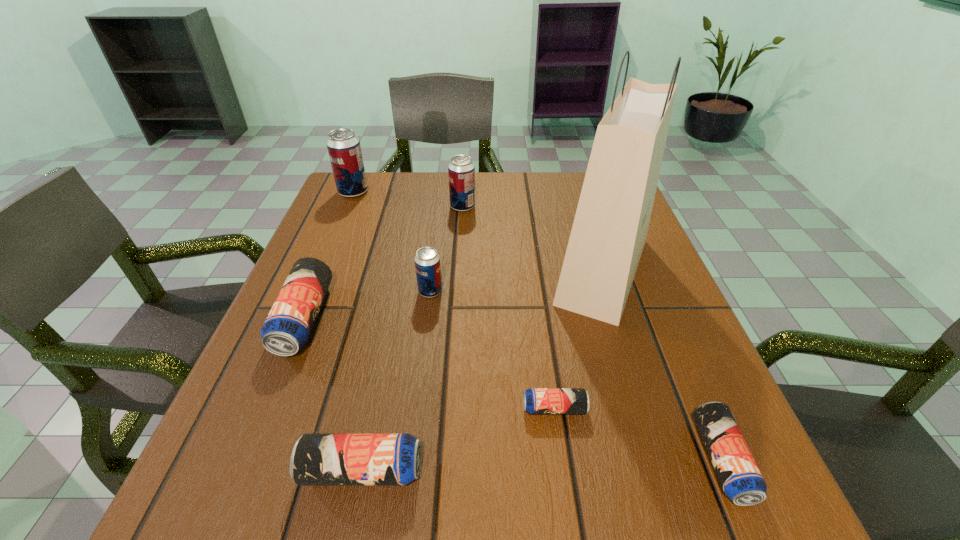
In the image, there is a desktop. At what (x,y) coordinates should I click in order to perform the action: click on blank space at the right edge. Please return your answer as a coordinate pair (x, y). The height and width of the screenshot is (540, 960). Looking at the image, I should click on (653, 429).

The image size is (960, 540). Identify the location of vacant region at the far left corner of the desktop. (358, 202).

Where is `free spot at the near left corner of the desktop`? free spot at the near left corner of the desktop is located at coordinates (286, 517).

I want to click on vacant space at the near right corner, so (700, 474).

Find the location of `free space between the rightmost blue beer can and the sixth shortest beer can`. free space between the rightmost blue beer can and the sixth shortest beer can is located at coordinates (592, 333).

The height and width of the screenshot is (540, 960). Identify the location of free space between the fourth shortest object and the biggest red beer can. (328, 255).

The width and height of the screenshot is (960, 540). Identify the location of free space that is in between the second smallest blue beer can and the shopping bag. click(x=662, y=366).

Find the location of a particular element. This screenshot has height=540, width=960. unoccupied position between the farthest blue beer can and the second blue beer can from right to left is located at coordinates (429, 363).

You are a GUI agent. You are given a task and a screenshot of the screen. Output one action in this format:
    pyautogui.click(x=<x>, y=<y>)
    Task: Click on the free space between the rightmost beer can and the tallest object
    
    Given the screenshot: What is the action you would take?
    pyautogui.click(x=662, y=366)

The image size is (960, 540). Find the location of `vacant space that is in between the second shortest beer can and the fifth tallest object`. vacant space that is in between the second shortest beer can and the fifth tallest object is located at coordinates (513, 389).